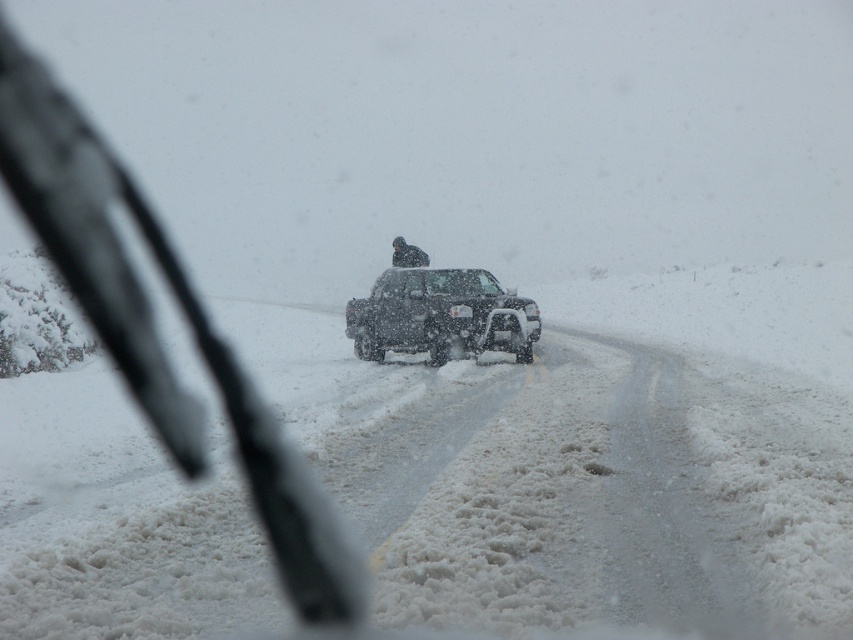
You are driving a car and see two points on the snowy road ahead. The first point is at coordinate point (380, 307), and the second is at point (413, 262). Which point is closer to your car?

Point (380, 307) is in front of point (413, 262), so the first point is closer to your car.